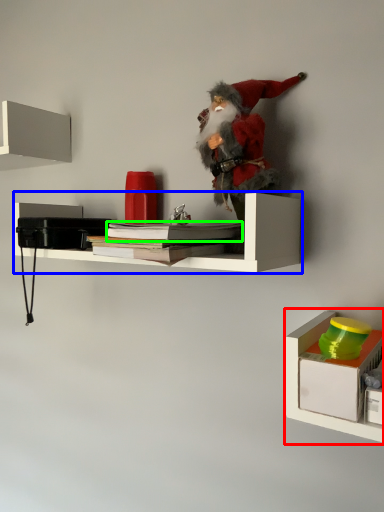
Question: Which is nearer to the shelf (highlighted by a red box)? shelf (highlighted by a blue box) or book (highlighted by a green box).

Choices:
 (A) shelf
 (B) book

Answer: (B)